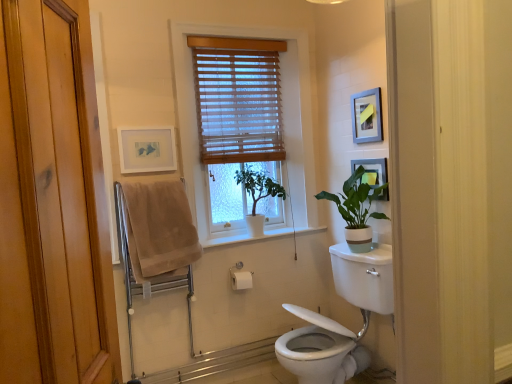
Find the location of a particular element. empty space that is ontop of beige cotton bath towel at left (from a real-world perspective) is located at coordinates (154, 182).